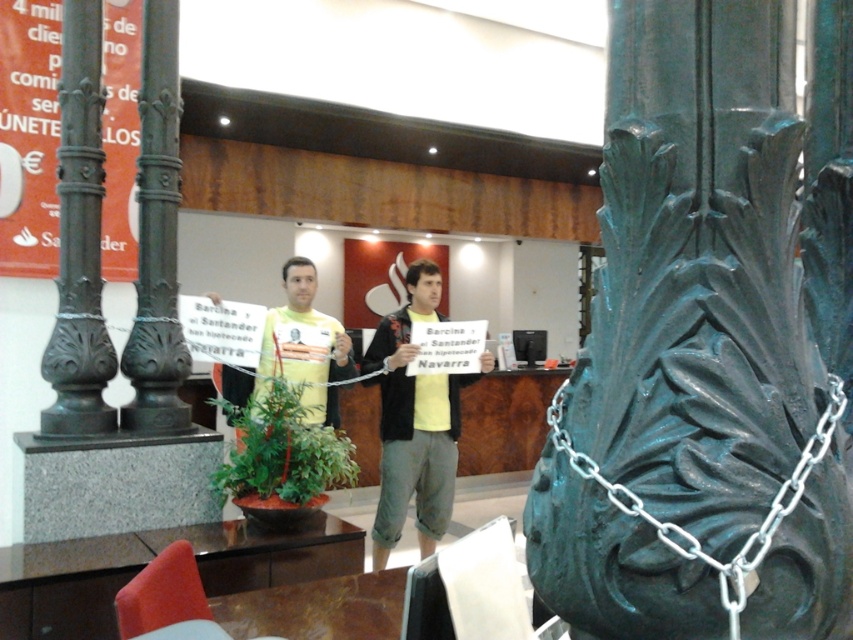
Does green patinated metal column at center have a greater height compared to bronze textured column at left?

No.

Who is higher up, green patinated metal column at center or bronze textured column at left?

bronze textured column at left is above.

Find the location of a particular element. This screenshot has height=640, width=853. green patinated metal column at center is located at coordinates (697, 314).

Is bronze textured column at left positioned in front of yellow matte shirt at center?

Yes, it is.

At what (x,y) coordinates should I click in order to perform the action: click on bronze textured column at left. Please return your answer as a coordinate pair (x, y). The width and height of the screenshot is (853, 640). Looking at the image, I should click on (157, 237).

You are a GUI agent. You are given a task and a screenshot of the screen. Output one action in this format:
    pyautogui.click(x=<x>, y=<y>)
    Task: Click on the bronze textured column at left
    This screenshot has width=853, height=640.
    Given the screenshot: What is the action you would take?
    pyautogui.click(x=157, y=237)

What do you see at coordinates (697, 314) in the screenshot?
I see `green patinated metal column at center` at bounding box center [697, 314].

Measure the distance between point (x=764, y=296) and camera.

Point (x=764, y=296) and camera are 3.64 feet apart from each other.

Which is behind, point (573, 600) or point (80, 269)?

Point (80, 269)

In order to click on green patinated metal column at center in this screenshot , I will do `click(697, 314)`.